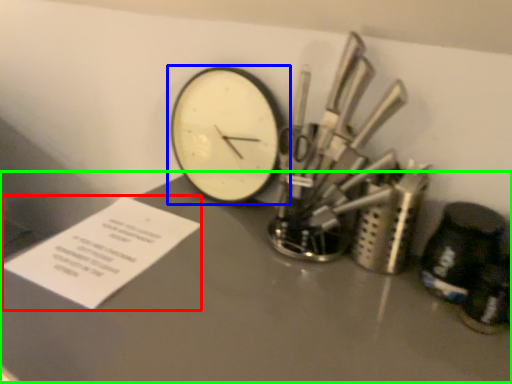
Question: Which object is the closest to the paper (highlighted by a red box)? Choose among these: wall clock (highlighted by a blue box) or table (highlighted by a green box).

Choices:
 (A) wall clock
 (B) table

Answer: (B)